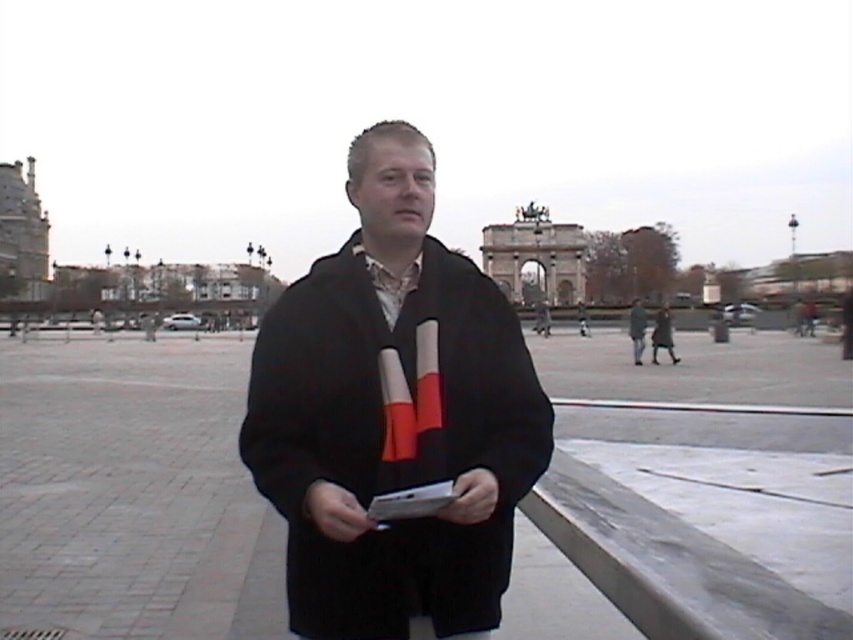
Question: Based on their relative distances, which object is nearer to the black wool scarf at center?

Choices:
 (A) brick pavement at center
 (B) dark gray wool coat at center

Answer: (A)

Question: Which point appears farthest from the camera in this image?

Choices:
 (A) (450, 376)
 (B) (100, 362)

Answer: (B)

Question: Is brick pavement at center to the left of dark gray wool coat at center from the viewer's perspective?

Choices:
 (A) yes
 (B) no

Answer: (A)

Question: Can you confirm if black wool scarf at center is wider than dark gray wool coat at center?

Choices:
 (A) no
 (B) yes

Answer: (B)

Question: Observing the image, what is the correct spatial positioning of brick pavement at center in reference to black wool scarf at center?

Choices:
 (A) right
 (B) left

Answer: (A)

Question: Which point is farther from the camera taking this photo?

Choices:
 (A) (241, 554)
 (B) (345, 392)

Answer: (A)